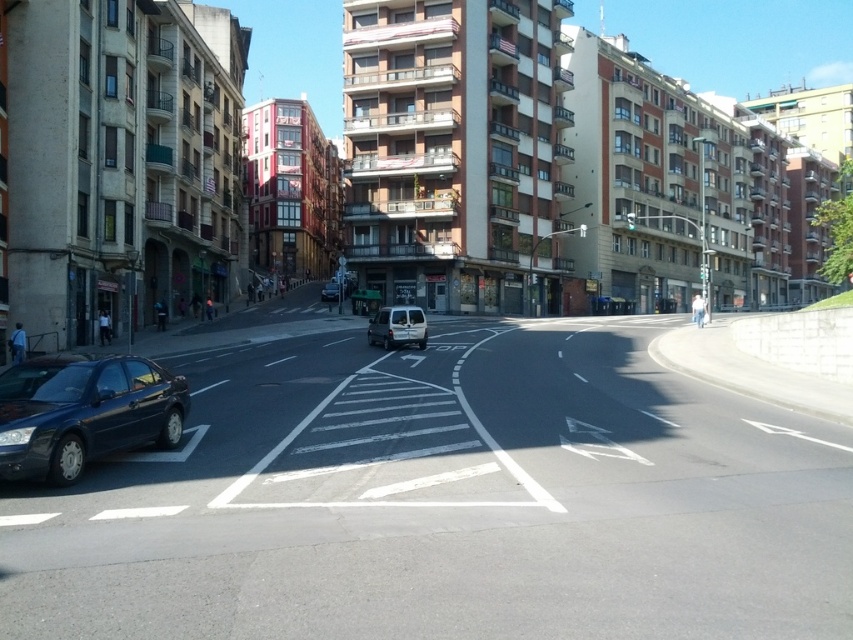
You are a delivery driver who needs to park your vehicle in this urban area. You have a delivery van that is 5 meters long. The parking space available is between the matte black car at lower left and the matte silver van at center. Can your van fit in this space?

The distance between the matte black car at lower left and the matte silver van at center is 47.27 meters, which is more than enough to accommodate a 5 meter long van. Yes, your van can fit in this space.